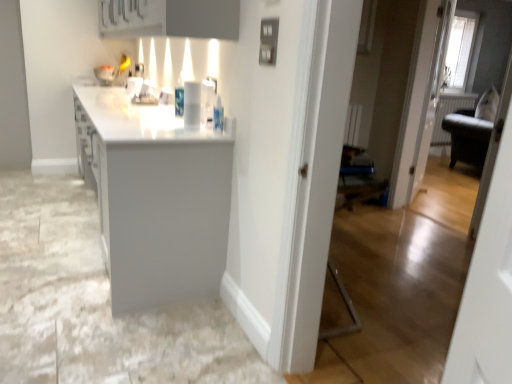
Find the location of `free location to the left of white glossy countertop at center`. free location to the left of white glossy countertop at center is located at coordinates (42, 206).